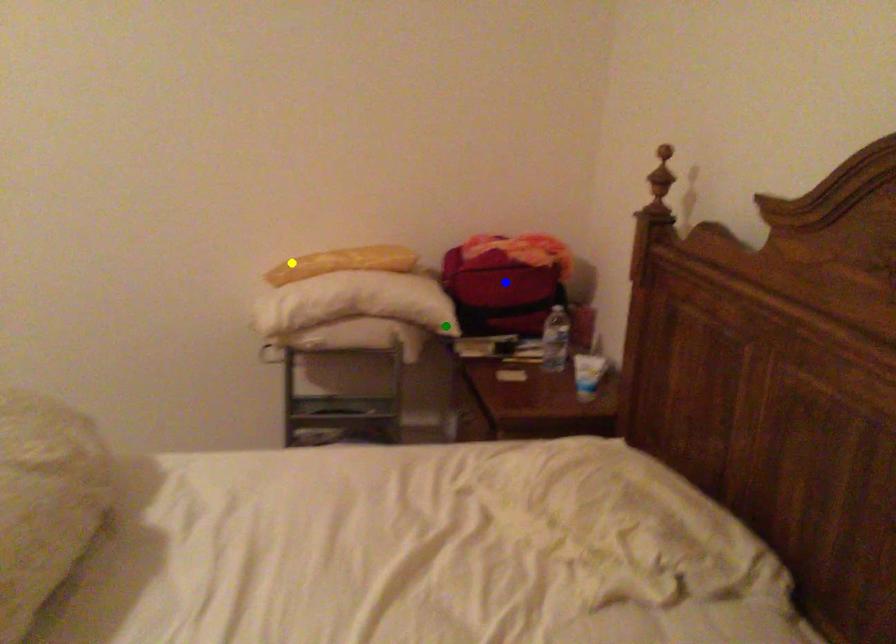
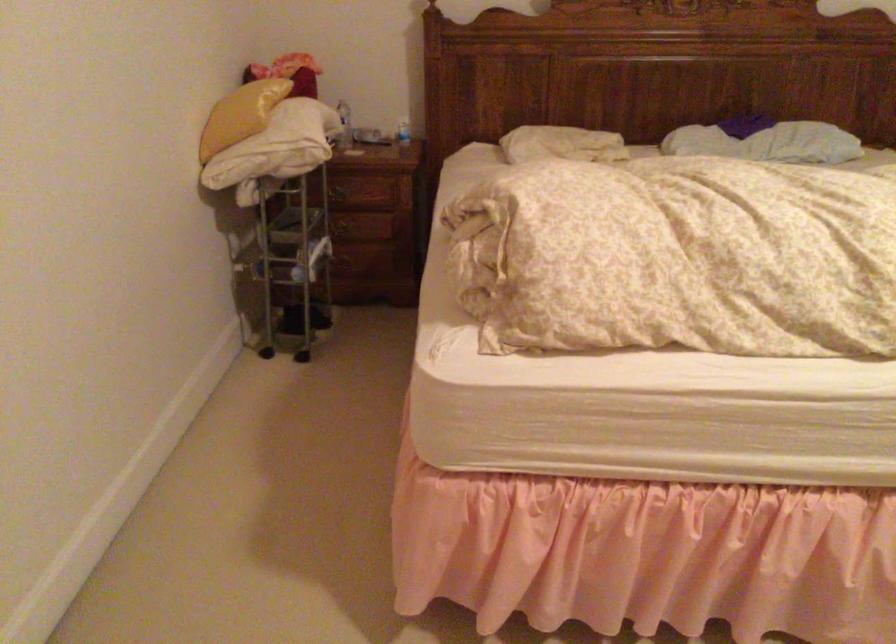
I am providing you with two images of the same scene from different viewpoints. Three points are marked in image1. Which point corresponds to a part or object that is occluded in image2?In image1, three points are marked. Which of them correspond to a part or object that is occluded in image2?Among the three points shown in image1, which one corresponds to a part or object that is no longer visible due to occlusion in image2?

blue point